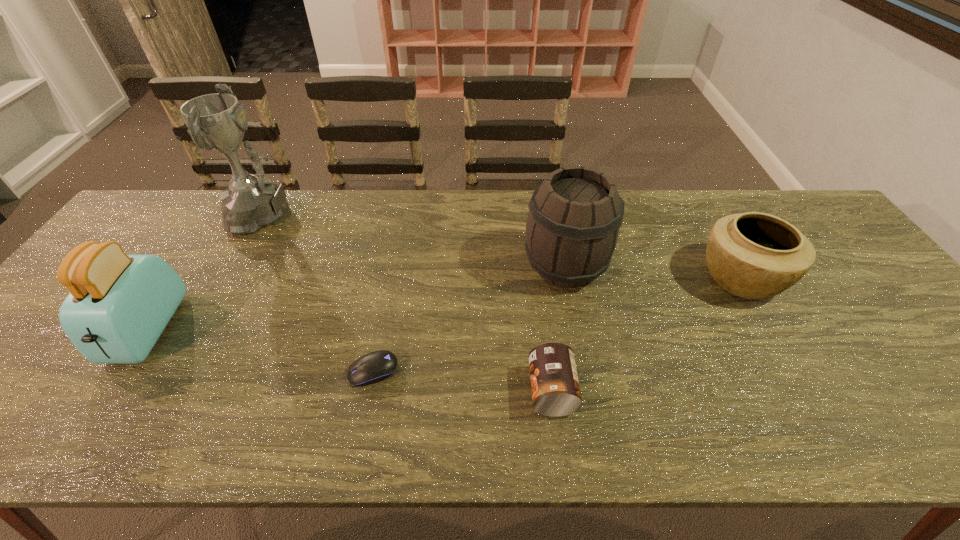
In order to click on blank area at the right edge in this screenshot , I will do `click(902, 319)`.

I want to click on vacant space that is in between the wine bucket and the award, so click(x=418, y=241).

This screenshot has width=960, height=540. What are the coordinates of `free space that is in between the can and the wine bucket` in the screenshot? It's located at (559, 328).

At what (x,y) coordinates should I click in order to perform the action: click on free space between the third shortest object and the tallest object. Please return your answer as a coordinate pair (x, y). The height and width of the screenshot is (540, 960). Looking at the image, I should click on (505, 246).

You are a GUI agent. You are given a task and a screenshot of the screen. Output one action in this format:
    pyautogui.click(x=<x>, y=<y>)
    Task: Click on the free space between the computer mouse and the pottery
    This screenshot has height=540, width=960.
    Given the screenshot: What is the action you would take?
    pyautogui.click(x=557, y=325)

Where is `free space that is in between the shortest object and the rightmost object`? This screenshot has width=960, height=540. free space that is in between the shortest object and the rightmost object is located at coordinates (557, 325).

Where is `free space that is in between the pottery and the wine bucket`? Image resolution: width=960 pixels, height=540 pixels. free space that is in between the pottery and the wine bucket is located at coordinates (653, 272).

Find the location of a particular element. The width and height of the screenshot is (960, 540). vacant region between the tallest object and the rightmost object is located at coordinates (505, 246).

Locate an element on the screen. Image resolution: width=960 pixels, height=540 pixels. free space between the can and the toaster is located at coordinates (349, 360).

This screenshot has width=960, height=540. In order to click on free space between the fourth object from right to left and the fifth tallest object in this screenshot , I will do `click(463, 381)`.